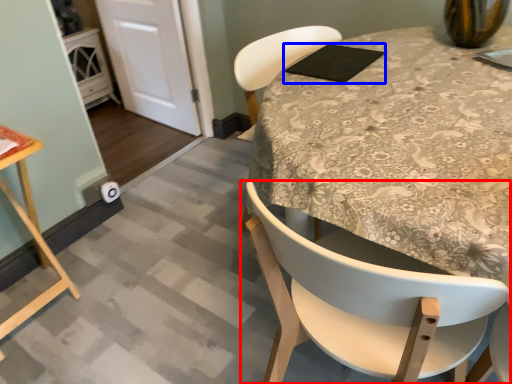
Question: Among these objects, which one is farthest to the camera, chair (highlighted by a red box) or pad (highlighted by a blue box)?

Choices:
 (A) chair
 (B) pad

Answer: (B)